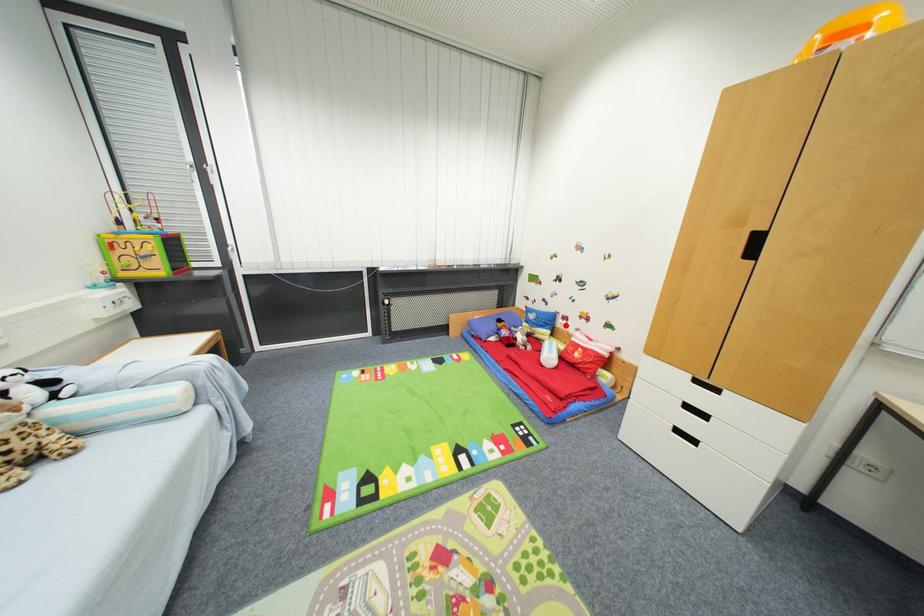
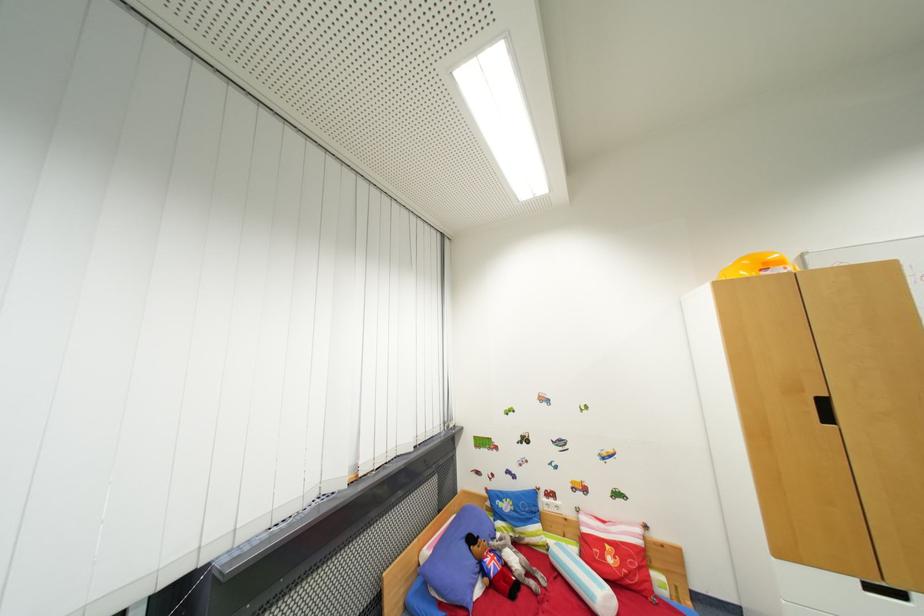
In the second image, find the point that corresponds to the highlighted location in the first image.

(550, 506)